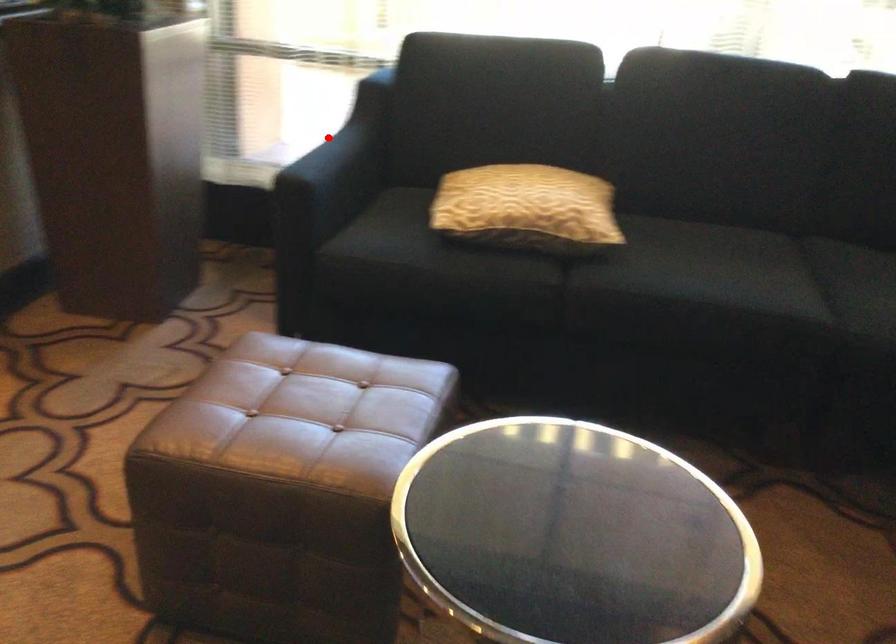
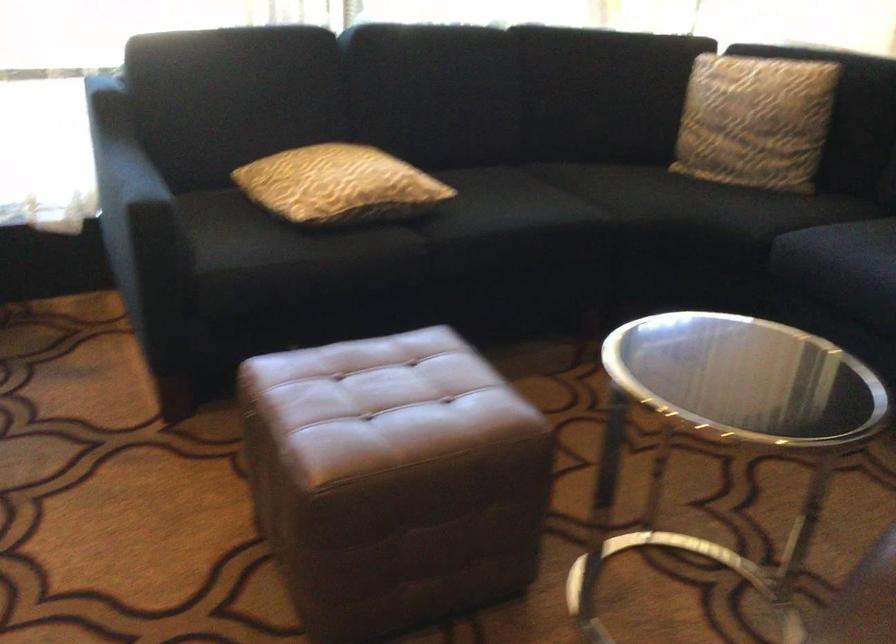
Question: I am providing you with two images of the same scene from different viewpoints. Image1 has a red point marked. In image2, the corresponding 3D location appears at what relative position? Reply with the corresponding letter.

Choices:
 (A) Closer
 (B) Farther

Answer: (A)